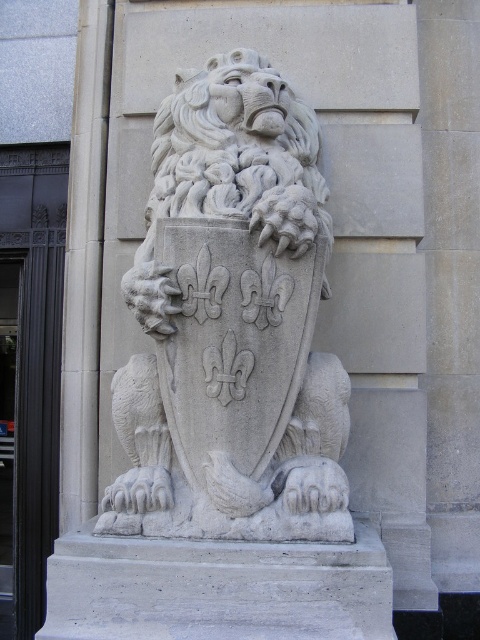
You are an art conservator tasked with moving the white stone lion at center to the storage room through the black metal door at left. Can you safely move the lion through the door without disassembling it?

The white stone lion at center is positioned over the black metal door at left, meaning it is likely blocking access to the door. To move it through the door, you would need to first remove it from its current position, which may require disassembling or repositioning it, so it might not be possible to move it through the door without disassembling it.

You are standing in a hallway and see two doors on your left. One is a black metal door at left and the other is a black glass door at left. Which door is more to the right?

The black metal door at left is positioned on the right side of black glass door at left, so the black metal door at left is more to the right.

You are an interior designer planning to place the white stone lion at center and the black glass door at left in a hallway. The hallway has a width of 1.8 meters. Can both objects fit side by side without overlapping?

The white stone lion at center might be wider than black glass door at left, so there is a possibility that they cannot fit side by side in the 1.8 meters hallway without overlapping. Further measurements are needed to confirm.